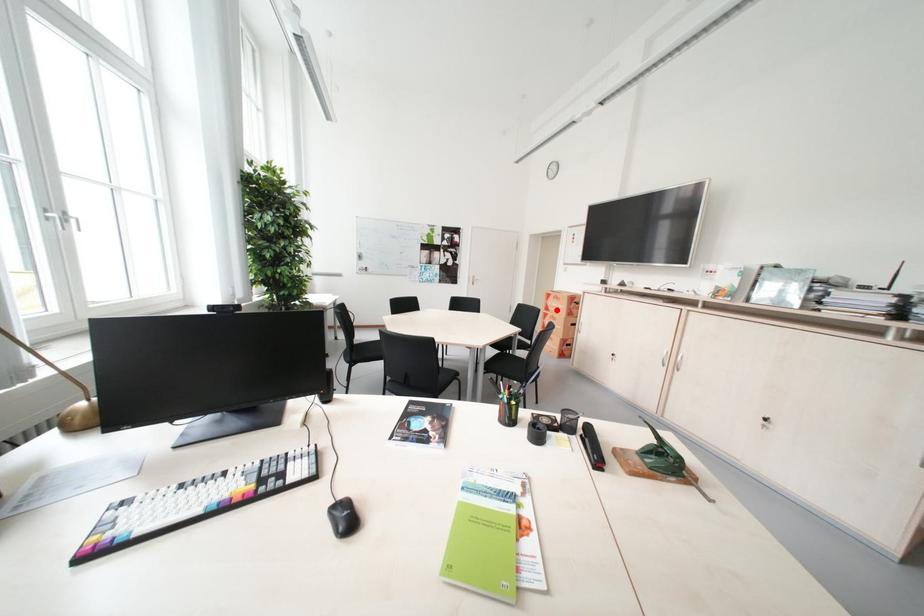
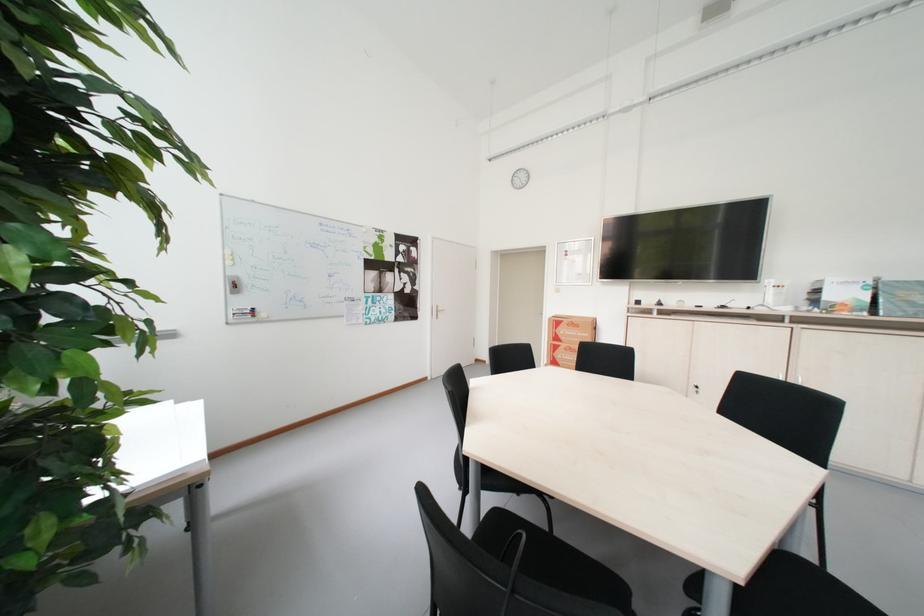
In the second image, find the point that corresponds to the highlighted location in the first image.

(565, 341)